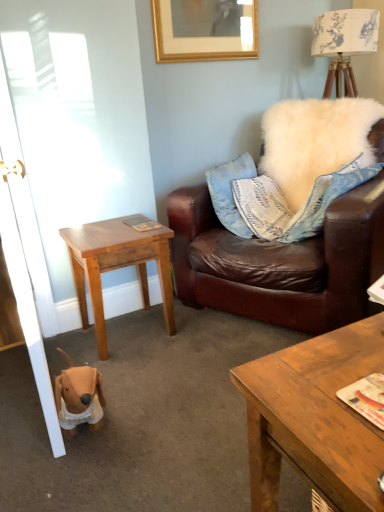
Question: Considering the relative sizes of white glossy door at left and light brown wooden table at lower left in the image provided, is white glossy door at left wider than light brown wooden table at lower left?

Choices:
 (A) yes
 (B) no

Answer: (A)

Question: From a real-world perspective, is white glossy door at left physically below light brown wooden table at lower left?

Choices:
 (A) yes
 (B) no

Answer: (B)

Question: Could you tell me if white glossy door at left is turned towards light brown wooden table at lower left?

Choices:
 (A) no
 (B) yes

Answer: (A)

Question: Is white glossy door at left to the left of light brown wooden table at lower left from the viewer's perspective?

Choices:
 (A) no
 (B) yes

Answer: (B)

Question: Can you confirm if white glossy door at left is thinner than light brown wooden table at lower left?

Choices:
 (A) no
 (B) yes

Answer: (A)

Question: In terms of width, does wooden coffee table at lower right look wider or thinner when compared to light brown wooden table at lower left?

Choices:
 (A) wide
 (B) thin

Answer: (A)

Question: From the image's perspective, is wooden coffee table at lower right located above or below light brown wooden table at lower left?

Choices:
 (A) above
 (B) below

Answer: (B)

Question: Is point (269, 434) positioned closer to the camera than point (72, 229)?

Choices:
 (A) farther
 (B) closer

Answer: (B)

Question: In terms of height, does wooden coffee table at lower right look taller or shorter compared to light brown wooden table at lower left?

Choices:
 (A) short
 (B) tall

Answer: (B)

Question: Is light brown wooden table at lower left taller or shorter than gold wooden picture frame at upper center?

Choices:
 (A) short
 (B) tall

Answer: (B)

Question: Looking at their shapes, would you say light brown wooden table at lower left is wider or thinner than gold wooden picture frame at upper center?

Choices:
 (A) thin
 (B) wide

Answer: (B)

Question: From the image's perspective, relative to gold wooden picture frame at upper center, is light brown wooden table at lower left above or below?

Choices:
 (A) below
 (B) above

Answer: (A)

Question: Relative to gold wooden picture frame at upper center, is light brown wooden table at lower left in front or behind?

Choices:
 (A) front
 (B) behind

Answer: (A)

Question: From the image's perspective, is light brown wooden table at lower left positioned above or below wooden coffee table at lower right?

Choices:
 (A) above
 (B) below

Answer: (A)

Question: Visually, is light brown wooden table at lower left positioned to the left or to the right of wooden coffee table at lower right?

Choices:
 (A) right
 (B) left

Answer: (B)